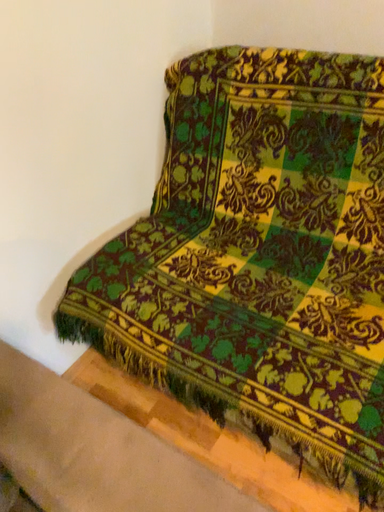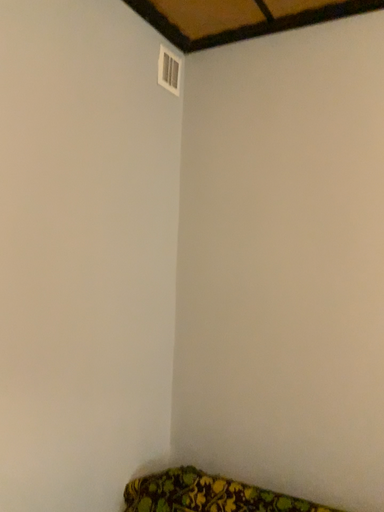
Question: Which way did the camera rotate in the video?

Choices:
 (A) rotated upward
 (B) rotated downward

Answer: (A)